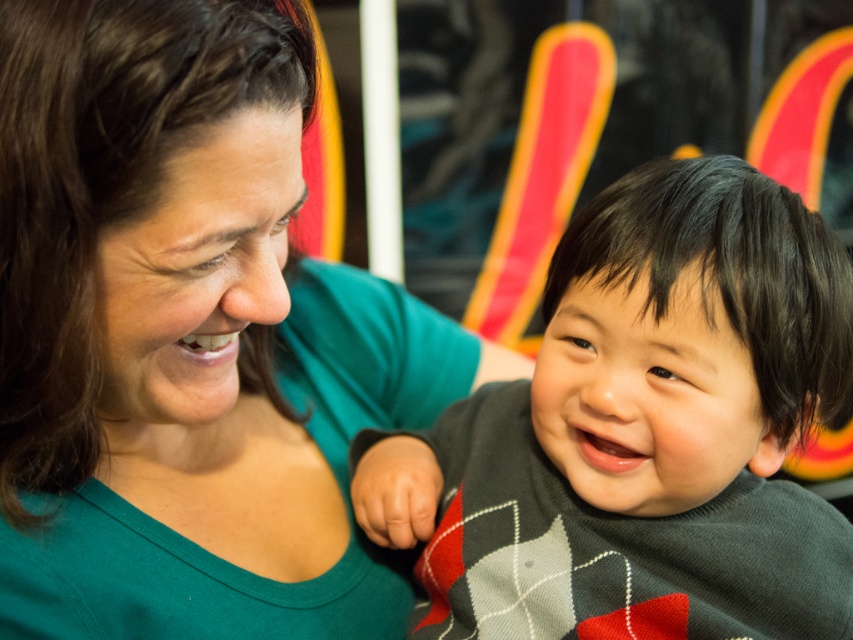
Which is more to the right, green matte shirt at center or dark gray sweater at center?

From the viewer's perspective, dark gray sweater at center appears more on the right side.

Which is below, green matte shirt at center or dark gray sweater at center?

dark gray sweater at center is below.

Between point (202, 538) and point (457, 529), which one is positioned behind?

The point (457, 529) is more distant.

Locate an element on the screen. green matte shirt at center is located at coordinates (187, 336).